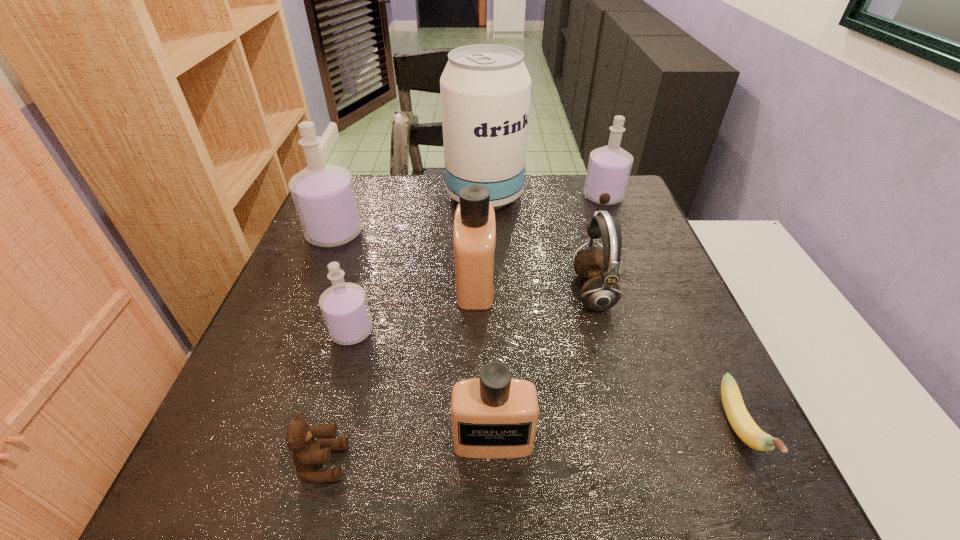
Identify the location of vacant space that's between the second nearest perfume and the nearest perfume. The width and height of the screenshot is (960, 540). 422,386.

You are a GUI agent. You are given a task and a screenshot of the screen. Output one action in this format:
    pyautogui.click(x=<x>, y=<y>)
    Task: Click on the empty space between the tallest object and the smaller beige perfume
    The height and width of the screenshot is (540, 960).
    Given the screenshot: What is the action you would take?
    pyautogui.click(x=489, y=318)

Locate an element on the screen. The width and height of the screenshot is (960, 540). empty location between the earphone and the bigger beige perfume is located at coordinates (534, 286).

Find the location of a particular element. This screenshot has width=960, height=540. vacant region between the third object from right to left and the eighth tallest object is located at coordinates (458, 376).

Where is `vacant space that is in between the nearer beige perfume and the smallest purple perfume`? Image resolution: width=960 pixels, height=540 pixels. vacant space that is in between the nearer beige perfume and the smallest purple perfume is located at coordinates point(422,386).

What are the coordinates of `free space between the tallest object and the farthest perfume` in the screenshot? It's located at (544, 197).

This screenshot has height=540, width=960. Identify the location of unoccupied area between the farthest perfume and the teddy bear. (463, 329).

Locate an element on the screen. The width and height of the screenshot is (960, 540). free space between the rightmost object and the nearest purple perfume is located at coordinates (545, 380).

Locate an element on the screen. The height and width of the screenshot is (540, 960). object that is the nearest to the second shortest object is located at coordinates (495, 416).

At what (x,y) coordinates should I click in order to perform the action: click on the eighth closest object to the second purple perfume from right to left. Please return your answer as a coordinate pair (x, y). Looking at the image, I should click on (609, 167).